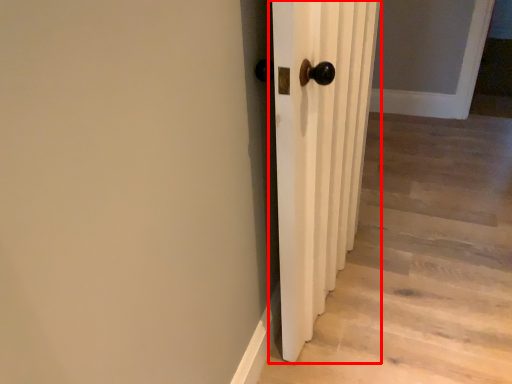
Question: From the image's perspective, where is door (annotated by the red box) located relative to stairwell?

Choices:
 (A) below
 (B) above

Answer: (B)